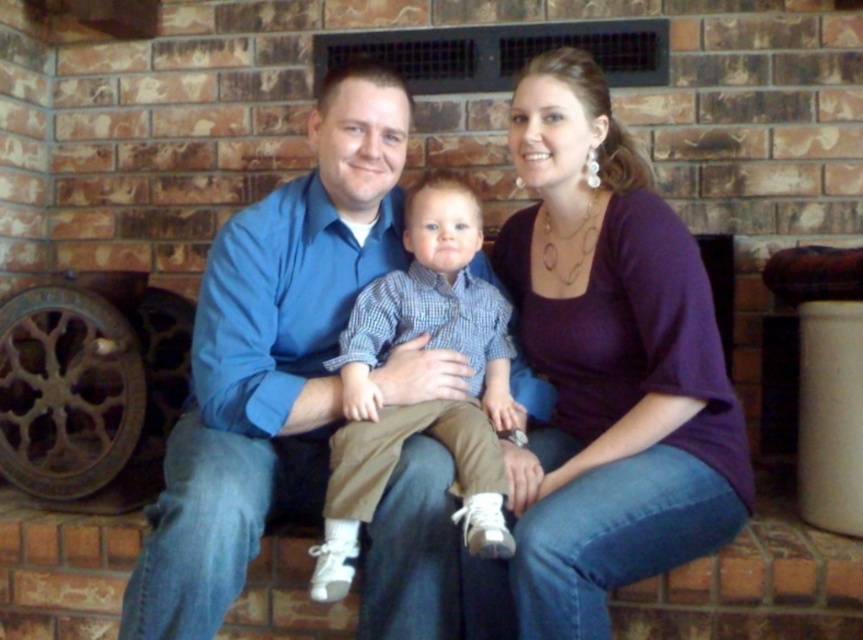
You are a tailor who needs to determine which shirt requires more fabric to alter. Based on the image, which shirt between the matte blue shirt at center and the checkered fabric shirt at center needs more fabric for alterations?

The matte blue shirt at center is larger in size than the checkered fabric shirt at center, so it would require more fabric for alterations.

You are an interior designer observing the brick ledge scene. You need to determine the order of the purple soft shirt at center and the blue cotton shirt at center from the viewer. Which one is closer to you?

The purple soft shirt at center is in front of the blue cotton shirt at center, so the purple soft shirt at center is closer to you.